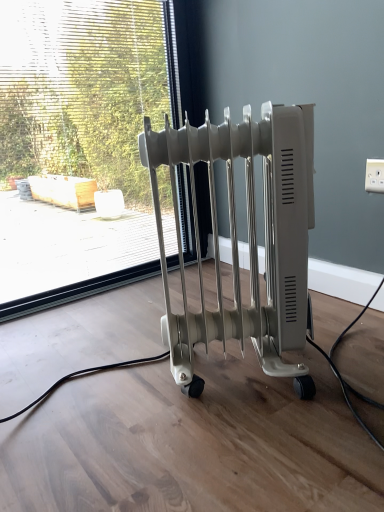
You are a GUI agent. You are given a task and a screenshot of the screen. Output one action in this format:
    pyautogui.click(x=<x>, y=<y>)
    Task: Click on the vacant space in front of white plastic radiator at center
    Image resolution: width=384 pixels, height=512 pixels.
    Given the screenshot: What is the action you would take?
    pyautogui.click(x=249, y=454)